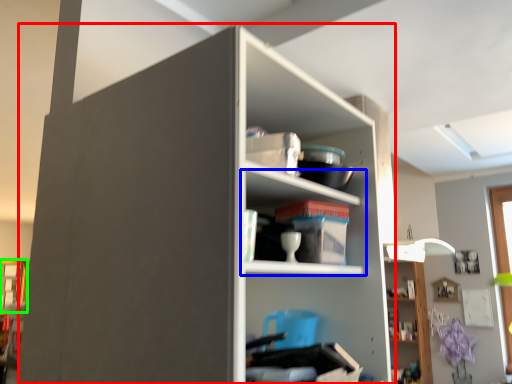
Question: Based on their relative distances, which object is nearer to shelf (highlighted by a red box)? Choose from shelf (highlighted by a blue box) and window (highlighted by a green box).

Choices:
 (A) shelf
 (B) window

Answer: (A)